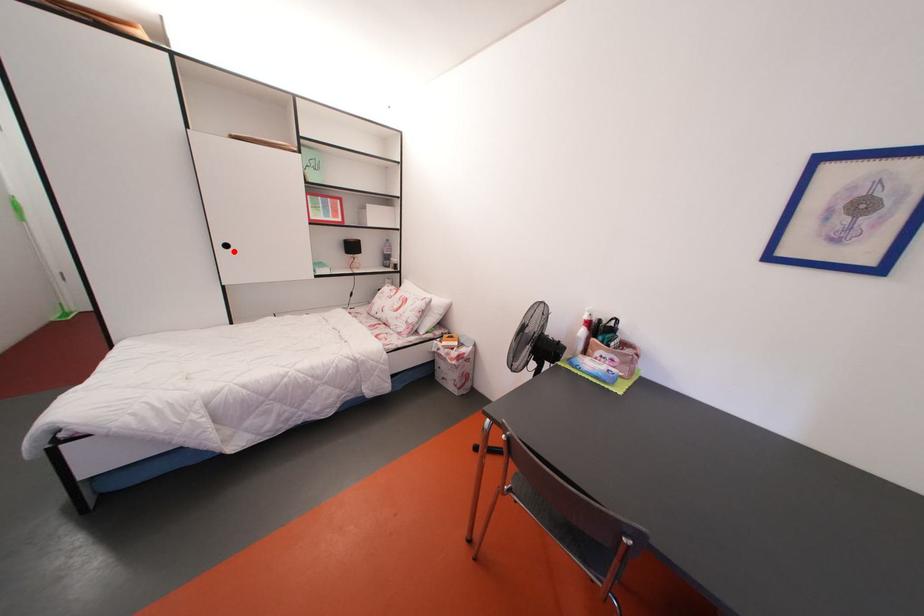
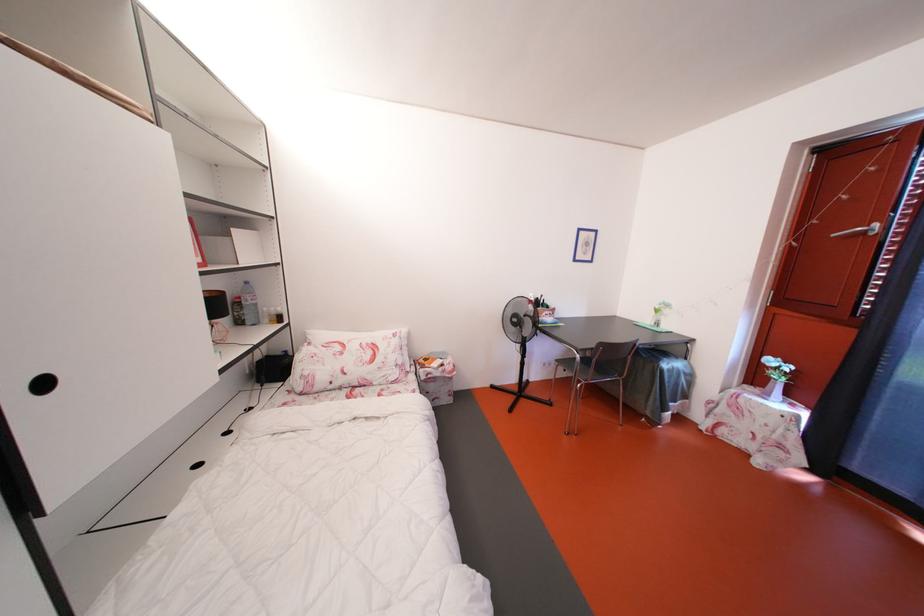
Locate, in the second image, the point that corresponds to the highlighted location in the first image.

(52, 390)